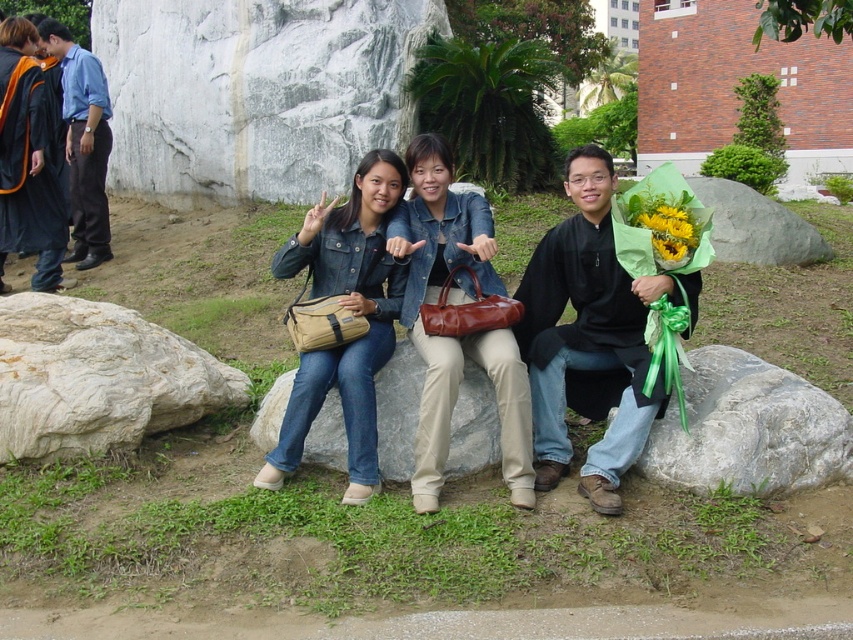
Question: Which point is farther from the camera taking this photo?

Choices:
 (A) (148, 397)
 (B) (415, 429)

Answer: (A)

Question: Considering the relative positions of matte black jacket at center and yellow paper flower at center in the image provided, where is matte black jacket at center located with respect to yellow paper flower at center?

Choices:
 (A) below
 (B) above

Answer: (A)

Question: Can you confirm if gray rough rock at lower left is positioned to the left of denim jacket at center?

Choices:
 (A) yes
 (B) no

Answer: (A)

Question: Can you confirm if denim jacket at center is smaller than yellow paper flower at center?

Choices:
 (A) yes
 (B) no

Answer: (B)

Question: Which point is closer to the camera?

Choices:
 (A) (691, 234)
 (B) (216, 406)
 (C) (405, 376)
 (D) (521, 413)

Answer: (D)

Question: Which is nearer to the gray rough rock at lower left?

Choices:
 (A) matte black jacket at center
 (B) denim jacket at center

Answer: (A)